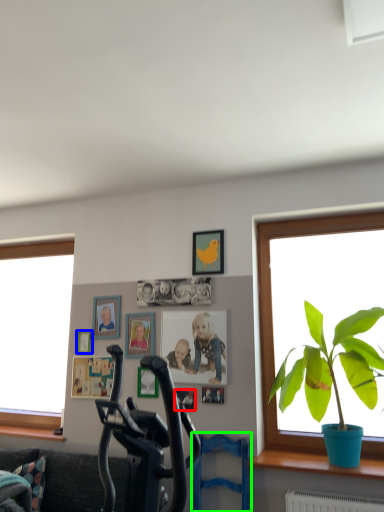
Question: Considering the real-world distances, which object is closest to picture frame (highlighted by a red box)? picture frame (highlighted by a blue box) or swivel chair (highlighted by a green box).

Choices:
 (A) picture frame
 (B) swivel chair

Answer: (B)